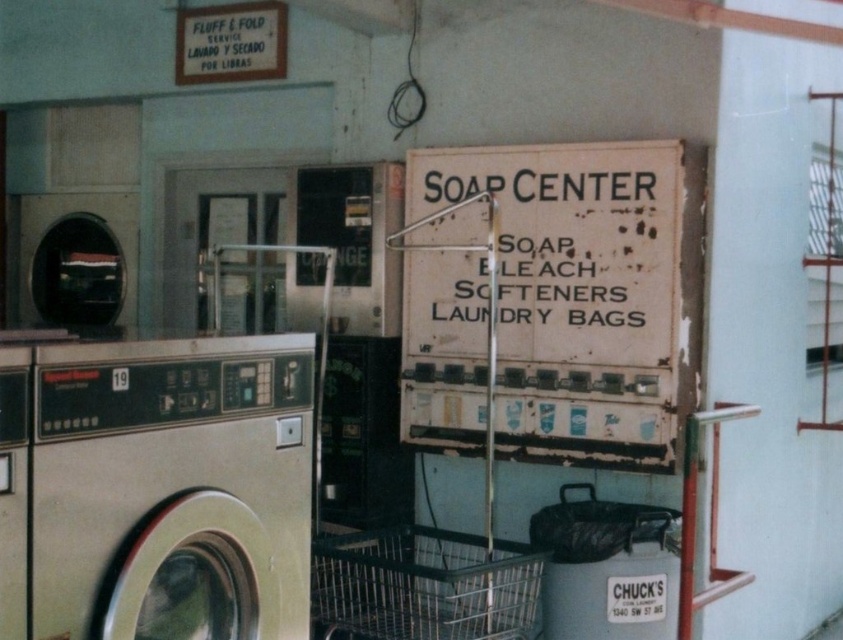
Question: Can you confirm if worn paper sign at center is smaller than metallic silver washing machine at left?

Choices:
 (A) yes
 (B) no

Answer: (B)

Question: Can you confirm if worn paper sign at center is bigger than metallic silver washing machine at left?

Choices:
 (A) yes
 (B) no

Answer: (A)

Question: Which object appears closest to the camera in this image?

Choices:
 (A) metallic wire laundry basket at lower center
 (B) metallic silver washing machine at left
 (C) worn paper sign at center

Answer: (B)

Question: Can you confirm if worn paper sign at center is positioned to the left of metallic silver washing machine at left?

Choices:
 (A) yes
 (B) no

Answer: (B)

Question: Among these objects, which one is farthest from the camera?

Choices:
 (A) metallic silver washing machine at left
 (B) worn paper sign at center

Answer: (B)

Question: Which point is farther from the camera taking this photo?

Choices:
 (A) (462, 353)
 (B) (407, 625)

Answer: (A)